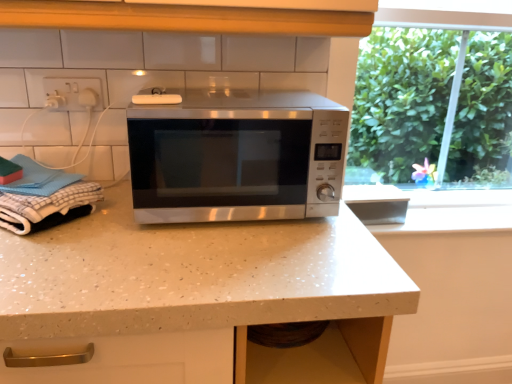
Question: Looking at the image, does white checkered cloth at left seem bigger or smaller compared to white plastic socket at upper left?

Choices:
 (A) small
 (B) big

Answer: (B)

Question: Is white checkered cloth at left in front of or behind white plastic socket at upper left in the image?

Choices:
 (A) front
 (B) behind

Answer: (A)

Question: Estimate the real-world distances between objects in this image. Which object is farther from the white plastic socket at upper left?

Choices:
 (A) white checkered cloth at left
 (B) white speckled laminate countertop at center
 (C) stainless steel microwave at center

Answer: (B)

Question: Estimate the real-world distances between objects in this image. Which object is closer to the white speckled laminate countertop at center?

Choices:
 (A) stainless steel microwave at center
 (B) white plastic socket at upper left
 (C) white checkered cloth at left

Answer: (A)